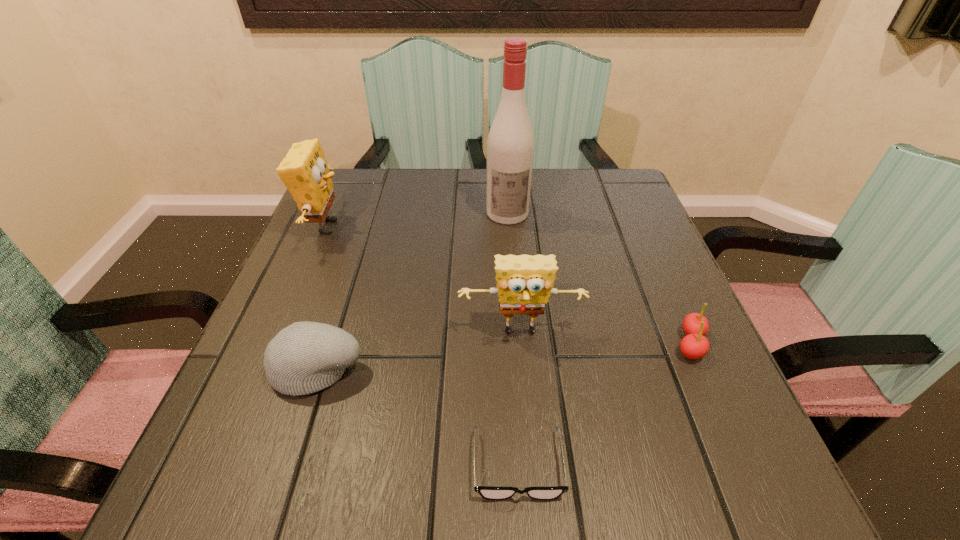
Find the location of a particular element. The width and height of the screenshot is (960, 540). free spot between the cherry and the alcohol is located at coordinates (599, 279).

This screenshot has width=960, height=540. I want to click on unoccupied position between the taller sponge and the beanie, so click(x=323, y=297).

You are a GUI agent. You are given a task and a screenshot of the screen. Output one action in this format:
    pyautogui.click(x=<x>, y=<y>)
    Task: Click on the empty location between the tallest object and the cherry
    The height and width of the screenshot is (540, 960).
    Given the screenshot: What is the action you would take?
    pyautogui.click(x=599, y=279)

Image resolution: width=960 pixels, height=540 pixels. Find the location of `free space between the left sponge and the fourth tallest object`. free space between the left sponge and the fourth tallest object is located at coordinates (323, 297).

Locate an element on the screen. vacant space in between the fifth tallest object and the beanie is located at coordinates (504, 355).

I want to click on free spot between the third shortest object and the spectacles, so click(x=418, y=416).

Find the location of a particular element. Image resolution: width=960 pixels, height=540 pixels. free spot between the tallest object and the nearest object is located at coordinates (513, 339).

This screenshot has height=540, width=960. I want to click on free spot between the tallest object and the cherry, so click(599, 279).

Select which object is the third closest to the nearest object. Please provide its 2D coordinates. Your answer should be formatted as a tuple, i.e. [(x, y)], where the tuple contains the x and y coordinates of a point satisfying the conditions above.

[(694, 345)]

Choose which object is the fifth nearest neighbor to the left sponge. Please provide its 2D coordinates. Your answer should be formatted as a tuple, i.e. [(x, y)], where the tuple contains the x and y coordinates of a point satisfying the conditions above.

[(694, 345)]